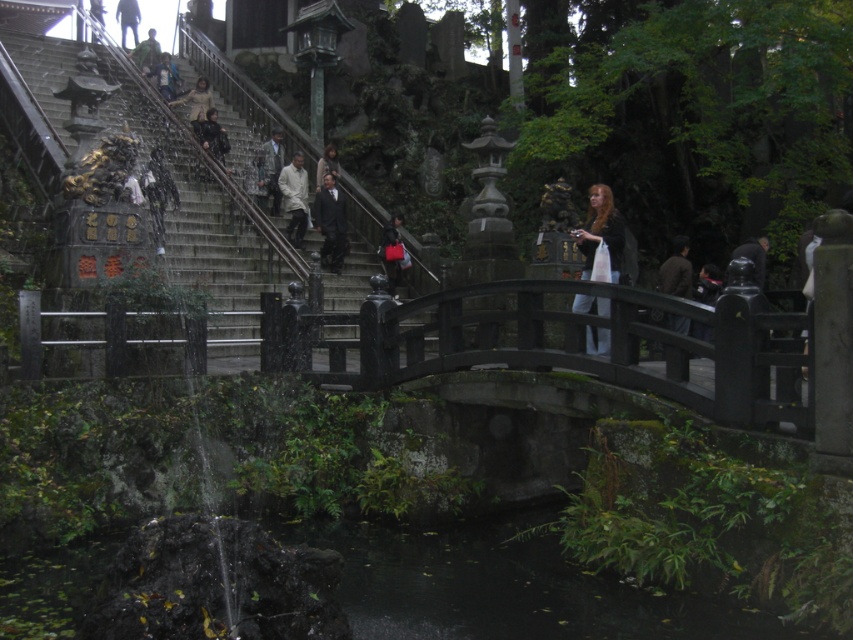
Question: Is dark gray suit at upper center thinner than light brown leather jacket at upper center?

Choices:
 (A) yes
 (B) no

Answer: (A)

Question: Which object is the closest to the smooth black statue at center?

Choices:
 (A) light brown leather jacket at upper center
 (B) dark gray stone pond at lower center

Answer: (B)

Question: Which point is closer to the camera?

Choices:
 (A) light beige fabric coat at center
 (B) matte brown statue at upper center
 (C) light brown fabric coat at upper center
 (D) dark gray stone pond at lower center

Answer: (D)

Question: Based on their relative distances, which object is farther from the dark gray suit at upper center?

Choices:
 (A) dark gray stone pond at lower center
 (B) light brown fabric coat at upper center

Answer: (A)

Question: Is dark gray stone pond at lower center wider than smooth black statue at center?

Choices:
 (A) yes
 (B) no

Answer: (A)

Question: Does matte black bag at center have a smaller size compared to camouflage uniform at upper center?

Choices:
 (A) yes
 (B) no

Answer: (A)